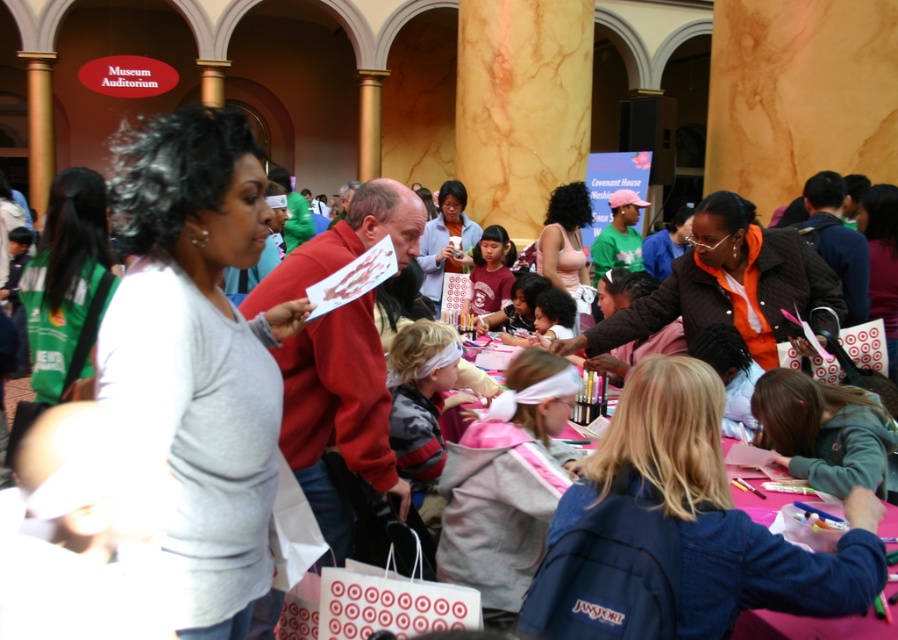
You are organizing a craft activity and need to move the striped fleece jacket at center to the green fabric bag at left. Can you carry the jacket directly to the bag without moving any other items, considering the space between them?

The distance between the green fabric bag at left and the striped fleece jacket at center is 3.25 meters. Since there is enough space, you can carry the jacket directly to the bag without needing to move other items.